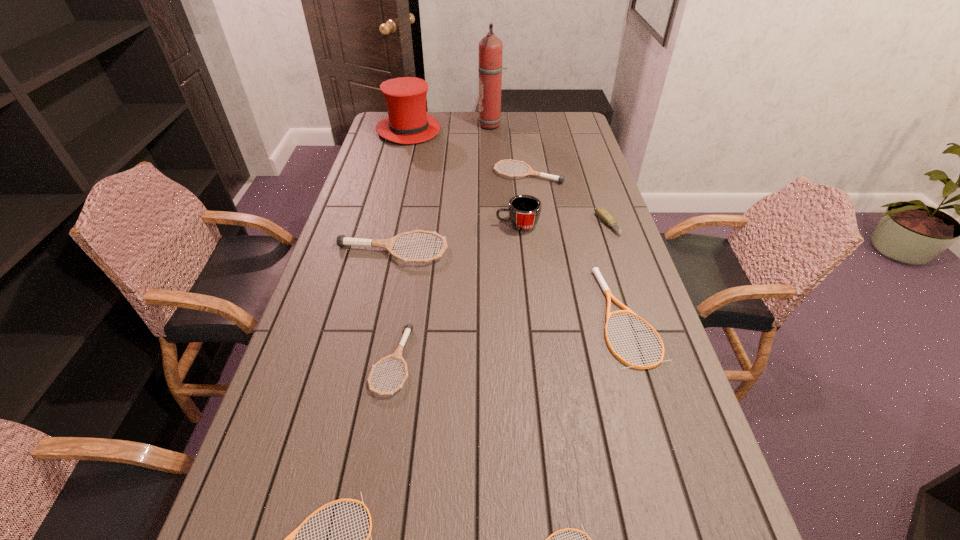
Where is `vacant area between the mug and the gray pocketknife`? Image resolution: width=960 pixels, height=540 pixels. vacant area between the mug and the gray pocketknife is located at coordinates (563, 225).

I want to click on vacant space that's between the eighth nearest object and the ninth shortest object, so click(468, 152).

Point out which object is positioned as the sixth nearest to the fire extinguisher. Please provide its 2D coordinates. Your answer should be formatted as a tuple, i.e. [(x, y)], where the tuple contains the x and y coordinates of a point satisfying the conditions above.

[(595, 270)]

The image size is (960, 540). Find the location of `object that is the eighth closest to the second biggest gray tennis racket`. object that is the eighth closest to the second biggest gray tennis racket is located at coordinates (289, 539).

I want to click on the third closest tennis racket to the hat, so click(x=595, y=270).

Choose which tennis racket is the third nearest neighbor to the fourth shortest tennis racket. Please provide its 2D coordinates. Your answer should be formatted as a tuple, i.e. [(x, y)], where the tuple contains the x and y coordinates of a point satisfying the conditions above.

[(569, 529)]

Locate an element on the screen. The width and height of the screenshot is (960, 540). gray tennis racket that stands as the closest to the mug is located at coordinates (342, 240).

Select which gray tennis racket appears as the third closest to the ninth shortest object. Please provide its 2D coordinates. Your answer should be formatted as a tuple, i.e. [(x, y)], where the tuple contains the x and y coordinates of a point satisfying the conditions above.

[(397, 354)]

Locate which beige tennis racket ranks second in proximity to the red hat. Please provide its 2D coordinates. Your answer should be formatted as a tuple, i.e. [(x, y)], where the tuple contains the x and y coordinates of a point satisfying the conditions above.

[(289, 539)]

Identify the location of the closest beige tennis racket to the tallest object. (595, 270).